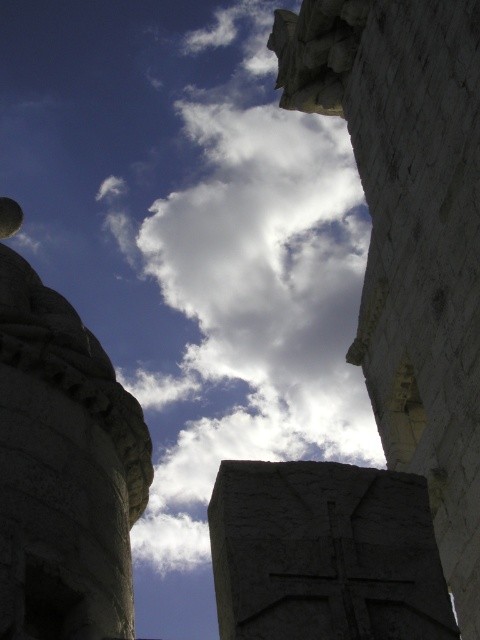
Question: Can you confirm if white fluffy cloud at center is positioned below white stone pillar at upper center?

Choices:
 (A) yes
 (B) no

Answer: (B)

Question: Considering the relative positions of white fluffy cloud at center and white stone pillar at upper center in the image provided, where is white fluffy cloud at center located with respect to white stone pillar at upper center?

Choices:
 (A) right
 (B) left

Answer: (B)

Question: Observing the image, what is the correct spatial positioning of white fluffy cloud at center in reference to white stone pillar at upper center?

Choices:
 (A) left
 (B) right

Answer: (A)

Question: Which of the following is the farthest from the observer?

Choices:
 (A) (236, 397)
 (B) (389, 74)

Answer: (A)

Question: Which object appears farthest from the camera in this image?

Choices:
 (A) white fluffy cloud at center
 (B) white stone pillar at upper center

Answer: (A)